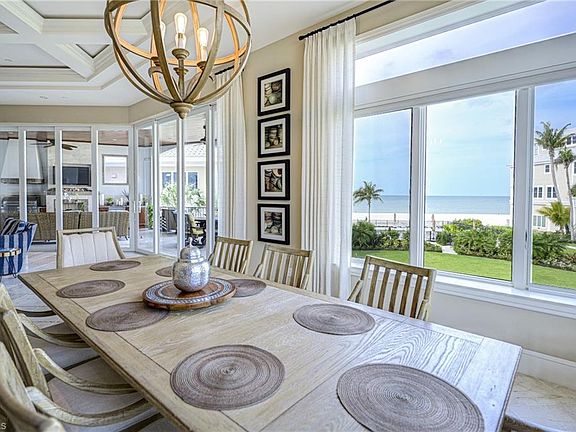
Image resolution: width=576 pixels, height=432 pixels. Find the location of `chair`. chair is located at coordinates (405, 274).